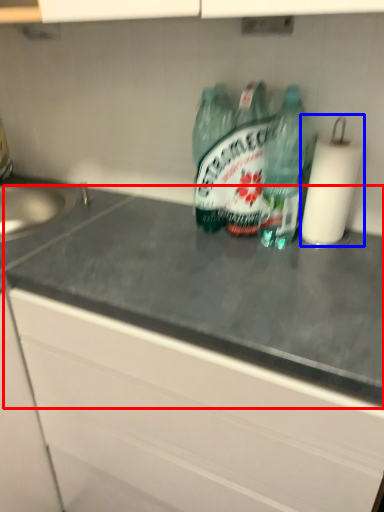
Question: Which of the following is the farthest to the observer, counter top (highlighted by a red box) or paper towel (highlighted by a blue box)?

Choices:
 (A) counter top
 (B) paper towel

Answer: (B)